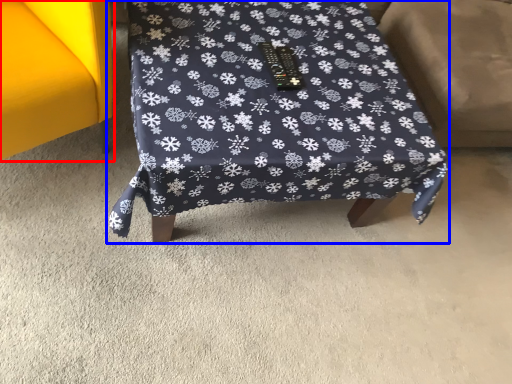
Question: Among these objects, which one is farthest to the camera, furniture (highlighted by a red box) or furniture (highlighted by a blue box)?

Choices:
 (A) furniture
 (B) furniture

Answer: (B)